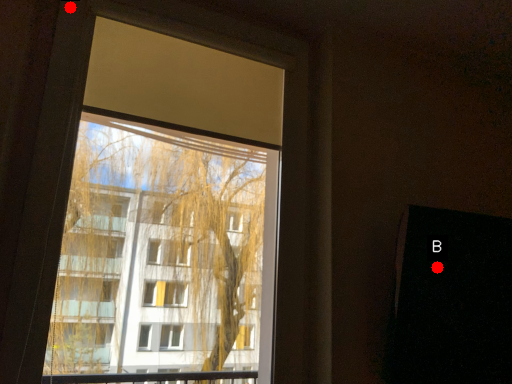
Question: Two points are circled on the image, labeled by A and B beside each circle. Which point is further to the camera?

Choices:
 (A) A is further
 (B) B is further

Answer: (B)